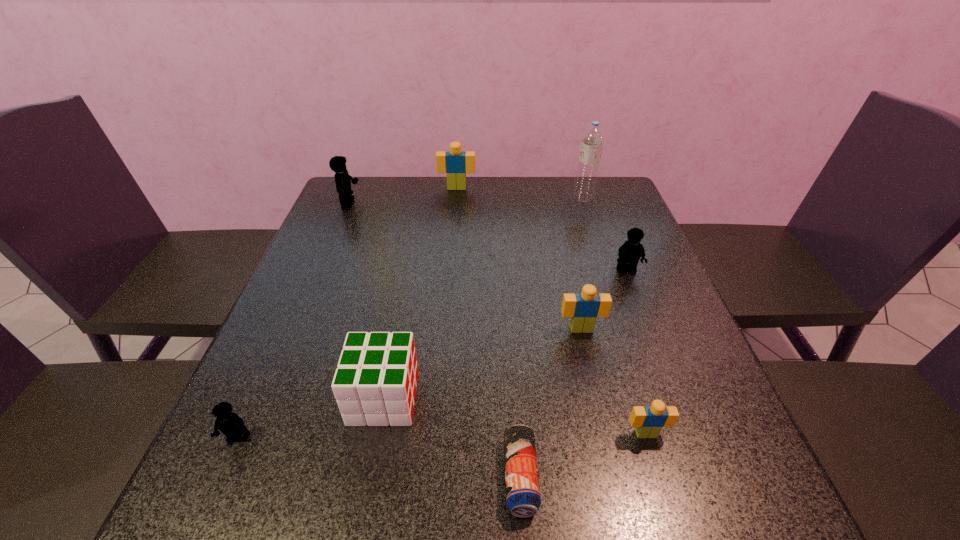
Locate an element on the screen. The height and width of the screenshot is (540, 960). beige Lego that can be found as the third closest to the fifth nearest Lego is located at coordinates (649, 420).

Select which yellow Lego is the third closest to the cube. Please provide its 2D coordinates. Your answer should be formatted as a tuple, i.e. [(x, y)], where the tuple contains the x and y coordinates of a point satisfying the conditions above.

[(337, 164)]

Where is `yellow Lego that can be found as the second closest to the nearest yellow Lego`? yellow Lego that can be found as the second closest to the nearest yellow Lego is located at coordinates (630, 252).

Where is `free spot that satisfies the following two spatial constraints: 1. on the front side of the tallest object; 2. on the front-facing side of the fifth nearest Lego`? This screenshot has height=540, width=960. free spot that satisfies the following two spatial constraints: 1. on the front side of the tallest object; 2. on the front-facing side of the fifth nearest Lego is located at coordinates (586, 203).

The width and height of the screenshot is (960, 540). I want to click on vacant space that satisfies the following two spatial constraints: 1. on the front-facing side of the biggest yellow Lego; 2. on the back side of the beer can, so click(x=233, y=476).

Where is `free spot that satisfies the following two spatial constraints: 1. on the front-facing side of the shortest object; 2. on the left side of the nearest yellow Lego`? Image resolution: width=960 pixels, height=540 pixels. free spot that satisfies the following two spatial constraints: 1. on the front-facing side of the shortest object; 2. on the left side of the nearest yellow Lego is located at coordinates (222, 476).